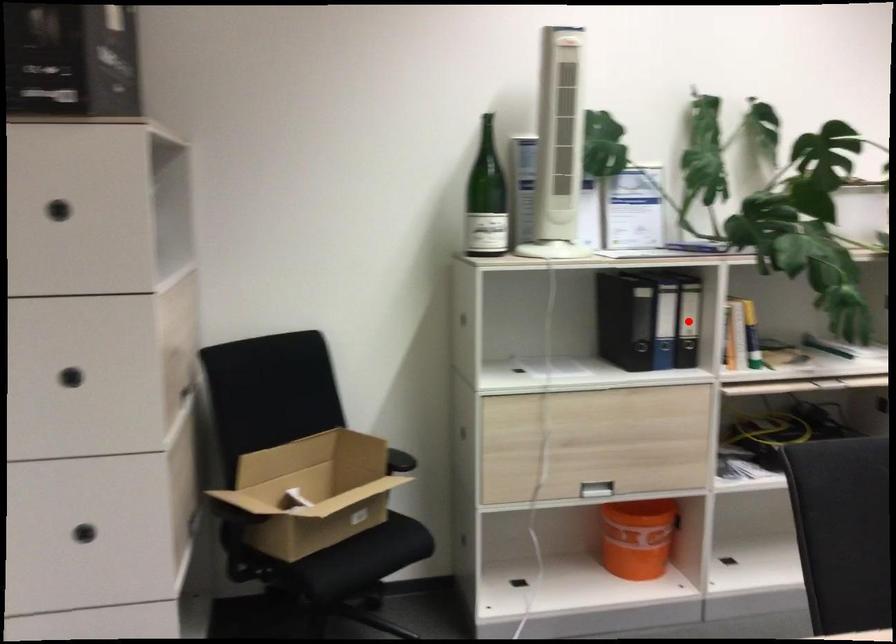
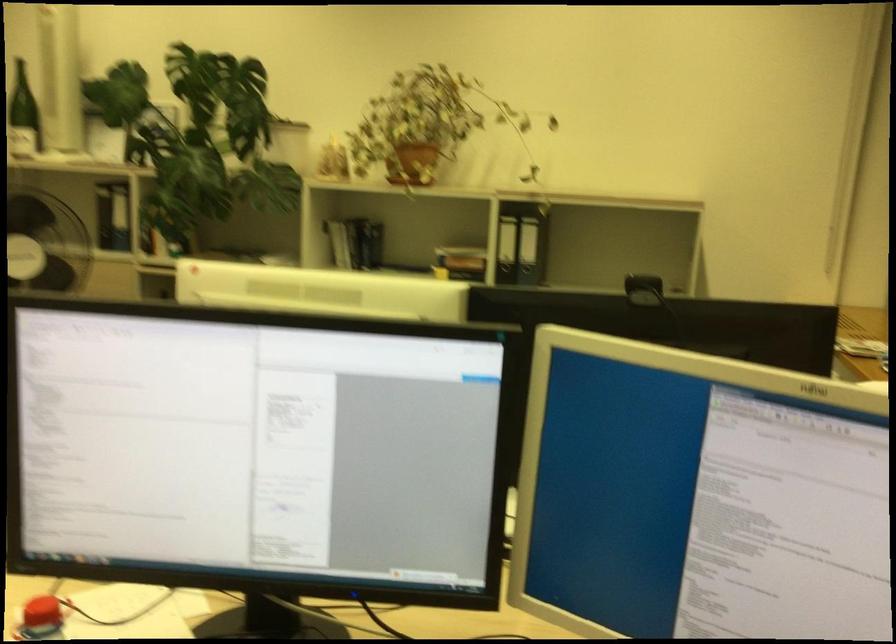
Question: I am providing you with two images of the same scene from different viewpoints. A red point is marked on the first image. Can you still see the location of the red point in image 2?

Choices:
 (A) Yes
 (B) No

Answer: (B)